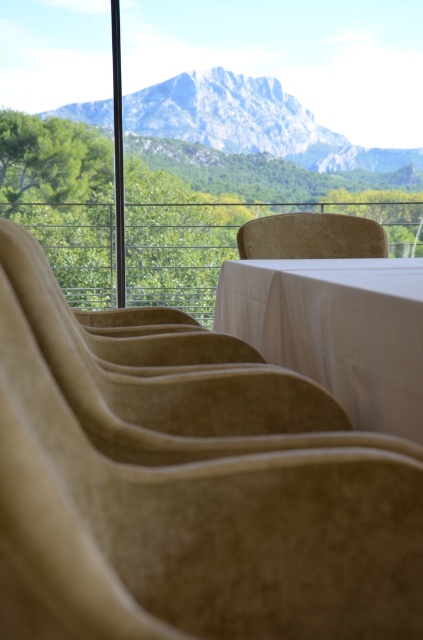
Does transparent glass window at center have a greater width compared to white clothed table at center?

Correct, the width of transparent glass window at center exceeds that of white clothed table at center.

Between transparent glass window at center and white clothed table at center, which one appears on the left side from the viewer's perspective?

transparent glass window at center

Where is `transparent glass window at center`? The height and width of the screenshot is (640, 423). transparent glass window at center is located at coordinates (241, 179).

Can you confirm if white clothed table at center is positioned to the right of beige fabric chair at center?

Incorrect, white clothed table at center is not on the right side of beige fabric chair at center.

Can you confirm if white clothed table at center is thinner than beige fabric chair at center?

Correct, white clothed table at center's width is less than beige fabric chair at center's.

Identify the location of white clothed table at center. (335, 330).

Who is shorter, transparent glass window at center or beige fabric chair at center?

Standing shorter between the two is beige fabric chair at center.

Where is `transparent glass window at center`? The height and width of the screenshot is (640, 423). transparent glass window at center is located at coordinates (241, 179).

Identify the location of transparent glass window at center. The image size is (423, 640). (241, 179).